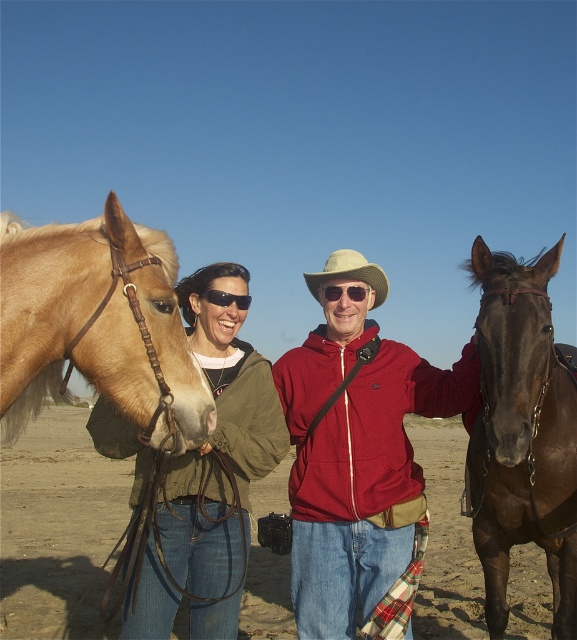
You are a photographer trying to capture the scene of two people with horses on the beach. You notice a point at coordinates (350, 273). Where is this point located?

The point at coordinates (350, 273) is located on the beige fabric cowboy hat at center.

You are a photographer taking a picture of the matte green jacket at center and the beige fabric cowboy hat at center. Which object should you focus on first to ensure both are in sharp focus?

You should focus on the matte green jacket at center first because it is closer to the viewer than the beige fabric cowboy hat at center, allowing for better depth of field coverage when focusing on the nearest subject first.